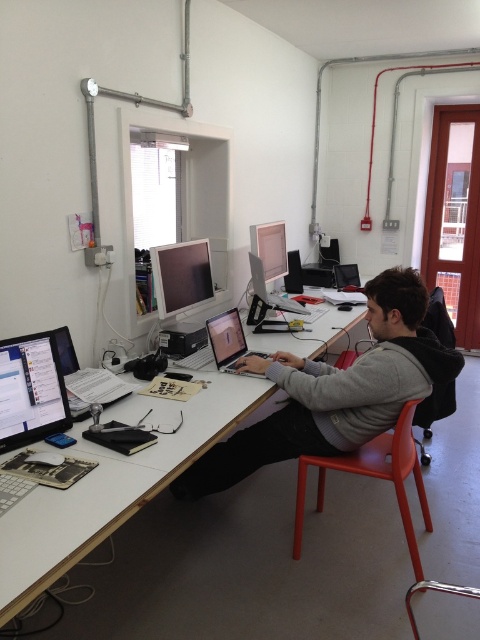
Question: Is gray sweater at center positioned behind matte black laptop at center?

Choices:
 (A) no
 (B) yes

Answer: (A)

Question: Which of the following is the farthest from the observer?

Choices:
 (A) matte black monitor at left
 (B) matte white monitor at upper center
 (C) gray sweater at center

Answer: (B)

Question: Does matte plastic monitor at center have a smaller size compared to matte white monitor at upper center?

Choices:
 (A) no
 (B) yes

Answer: (A)

Question: Observing the image, what is the correct spatial positioning of white wood table at center in reference to metallic plastic chair at center?

Choices:
 (A) left
 (B) right

Answer: (A)

Question: Which of these objects is positioned farthest from the matte white monitor at upper center?

Choices:
 (A) matte plastic chair at lower center
 (B) matte plastic monitor at center
 (C) gray sweater at center

Answer: (A)

Question: Which point is farther to the camera?

Choices:
 (A) matte plastic monitor at center
 (B) gray sweater at center
 (C) matte black monitor at left
 (D) matte plastic chair at lower center

Answer: (A)